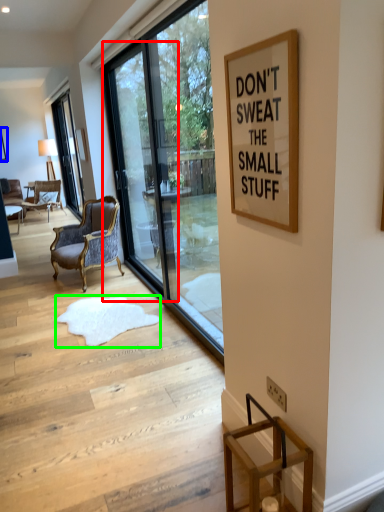
Question: Which object is positioned closest to screen door (highlighted by a red box)? Select from picture frame (highlighted by a blue box) and doormat (highlighted by a green box).

Choices:
 (A) picture frame
 (B) doormat

Answer: (B)